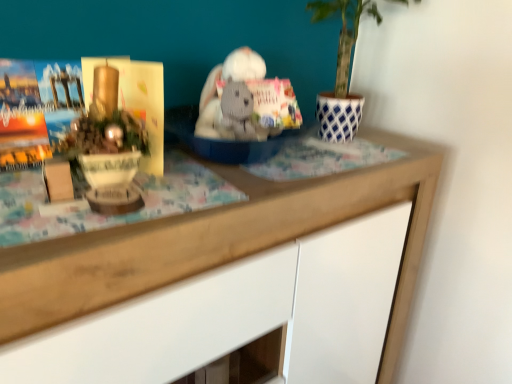
Question: Is wooden desk at center further to camera compared to matte gold paperback book at left?

Choices:
 (A) no
 (B) yes

Answer: (A)

Question: From a real-world perspective, is wooden desk at center positioned over matte gold paperback book at left based on gravity?

Choices:
 (A) yes
 (B) no

Answer: (B)

Question: From the image's perspective, would you say wooden desk at center is shown under matte gold paperback book at left?

Choices:
 (A) yes
 (B) no

Answer: (A)

Question: Can you confirm if wooden desk at center is thinner than matte gold paperback book at left?

Choices:
 (A) no
 (B) yes

Answer: (A)

Question: From a real-world perspective, is wooden desk at center under matte gold paperback book at left?

Choices:
 (A) yes
 (B) no

Answer: (A)

Question: Is wooden desk at center wider than matte gold paperback book at left?

Choices:
 (A) yes
 (B) no

Answer: (A)

Question: Could you tell me if white knitted bear at center is facing matte gold paperback book at left?

Choices:
 (A) no
 (B) yes

Answer: (A)

Question: Considering the relative sizes of white knitted bear at center and matte gold paperback book at left in the image provided, is white knitted bear at center thinner than matte gold paperback book at left?

Choices:
 (A) no
 (B) yes

Answer: (B)

Question: Is matte gold paperback book at left a part of white knitted bear at center?

Choices:
 (A) yes
 (B) no

Answer: (B)

Question: Is white knitted bear at center at the right side of matte gold paperback book at left?

Choices:
 (A) no
 (B) yes

Answer: (B)

Question: Is white knitted bear at center to the left of matte gold paperback book at left from the viewer's perspective?

Choices:
 (A) no
 (B) yes

Answer: (A)

Question: Can you confirm if white knitted bear at center is smaller than matte gold paperback book at left?

Choices:
 (A) no
 (B) yes

Answer: (B)

Question: Does white knitted bear at center appear on the right side of wooden desk at center?

Choices:
 (A) yes
 (B) no

Answer: (A)